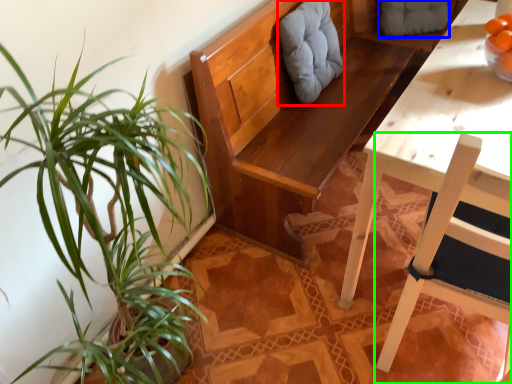
Question: Considering the real-world distances, which object is farthest from swivel chair (highlighted by a red box)? swivel chair (highlighted by a blue box) or chair (highlighted by a green box)?

Choices:
 (A) swivel chair
 (B) chair

Answer: (B)